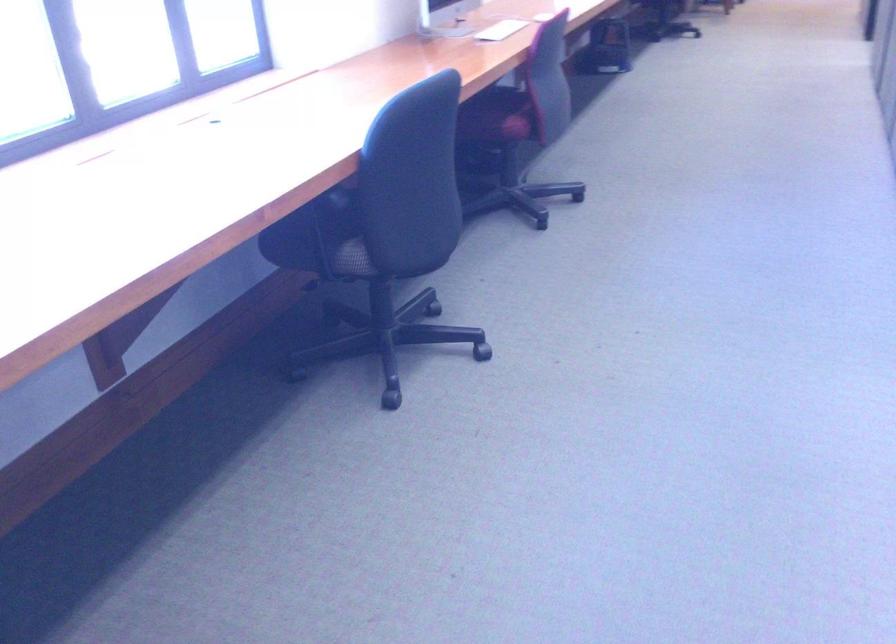
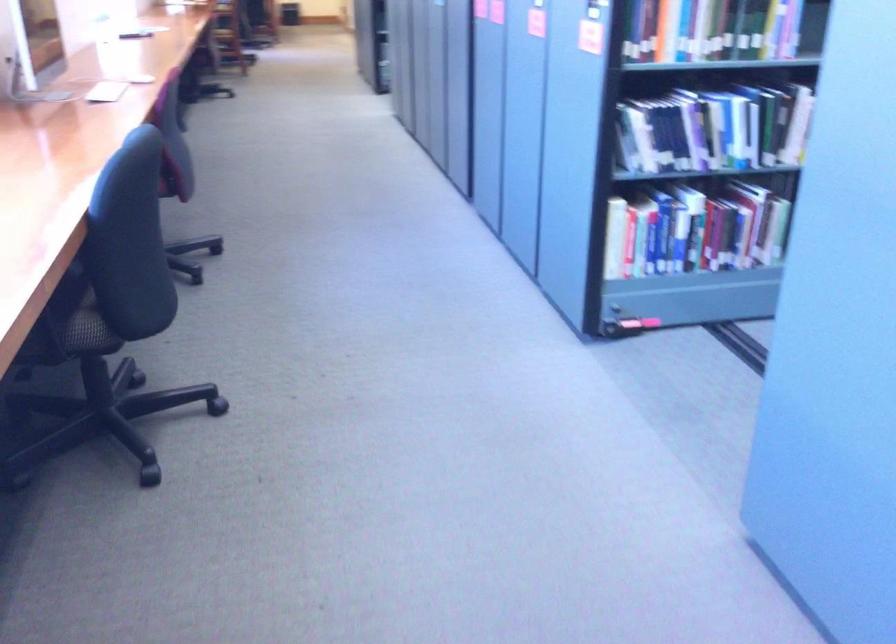
Question: I am providing you with two images of the same scene from different viewpoints. Which of the following objects are not visible in image2?

Choices:
 (A) shredder paper slot
 (B) black chair sitting surface
 (C) blue spine book
 (D) chair sitting surface

Answer: (D)